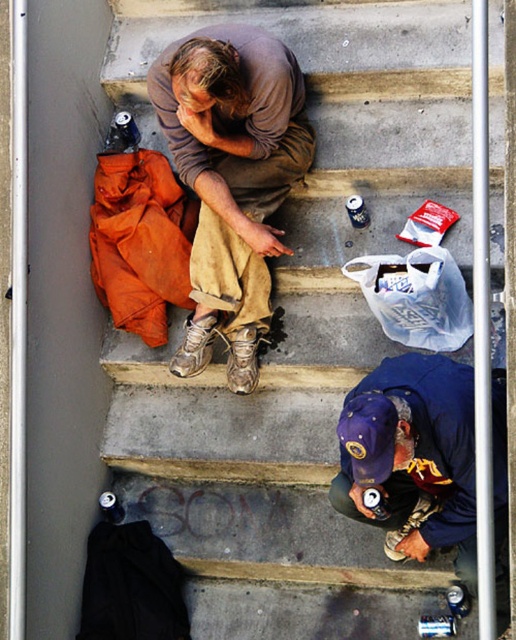
Who is taller, brown cotton shirt at center or blue fabric cap at lower center?

brown cotton shirt at center is taller.

In the scene shown: Does brown cotton shirt at center have a larger size compared to blue fabric cap at lower center?

Correct, brown cotton shirt at center is larger in size than blue fabric cap at lower center.

Does point (172, 131) come in front of point (507, 573)?

No, (172, 131) is further to viewer.

Identify the location of brown cotton shirt at center. The image size is (516, 640). (231, 168).

Is brown cotton shirt at center behind brown suede shoe at lower center?

No, it is not.

Does point (277, 113) come farther from viewer compared to point (434, 509)?

No.

Who is more distant from viewer, (205, 339) or (415, 522)?

Point (205, 339)

You are a GUI agent. You are given a task and a screenshot of the screen. Output one action in this format:
    pyautogui.click(x=<x>, y=<y>)
    Task: Click on the brown cotton shirt at center
    The height and width of the screenshot is (640, 516).
    Given the screenshot: What is the action you would take?
    pyautogui.click(x=231, y=168)

Does blue fabric cap at lower center have a larger size compared to brown leather boot at center?

Correct, blue fabric cap at lower center is larger in size than brown leather boot at center.

Is point (437, 488) closer to camera compared to point (244, 346)?

That is True.

This screenshot has width=516, height=640. Describe the element at coordinates (414, 452) in the screenshot. I see `blue fabric cap at lower center` at that location.

Locate an element on the screen. The height and width of the screenshot is (640, 516). blue fabric cap at lower center is located at coordinates (414, 452).